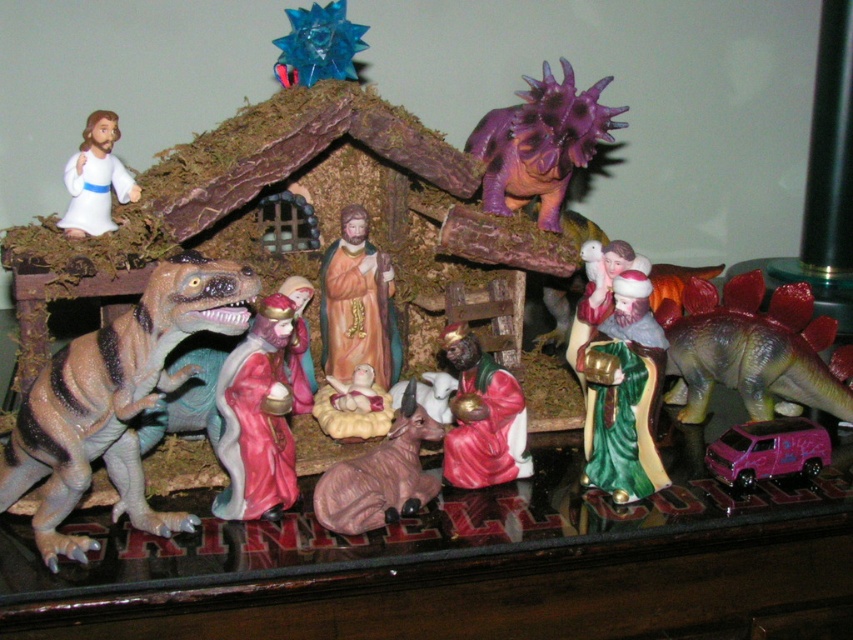
In the scene shown: You are a child who wants to stack the pink plastic car at lower right and the white matte figure at upper left. Which one should you place at the bottom to prevent the stack from falling over?

The pink plastic car at lower right has a lesser height compared to the white matte figure at upper left, so you should place the taller white matte figure at upper left at the bottom to provide a stable base for the stack.

You are a child looking at the nativity scene on the table. You see a point marked at coordinates (482, 417). What object is located at that point?

The point at coordinates (482, 417) corresponds to the matte red figurine at center.

You are setting up a Christmas display and want to place a small decoration between the matte red figurine at center and the pink plastic car at lower right. Considering their heights, which one should you place the decoration in front of to ensure it doesn

The matte red figurine at center is taller than the pink plastic car at lower right, so placing the decoration in front of the pink plastic car at lower right would keep it visible without being obscured by the taller figurine.